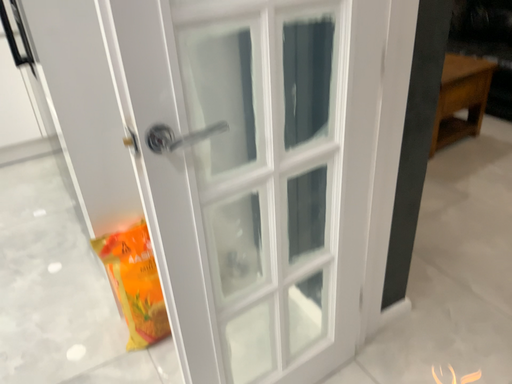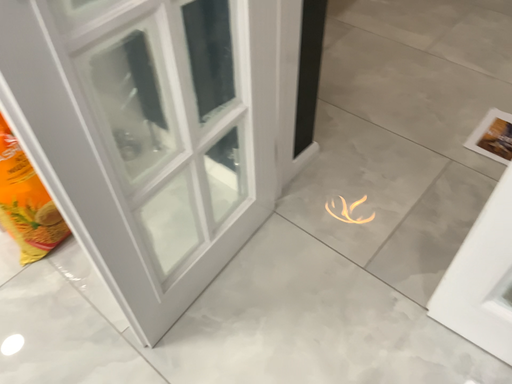
Question: How did the camera likely rotate when shooting the video?

Choices:
 (A) rotated downward
 (B) rotated upward

Answer: (A)